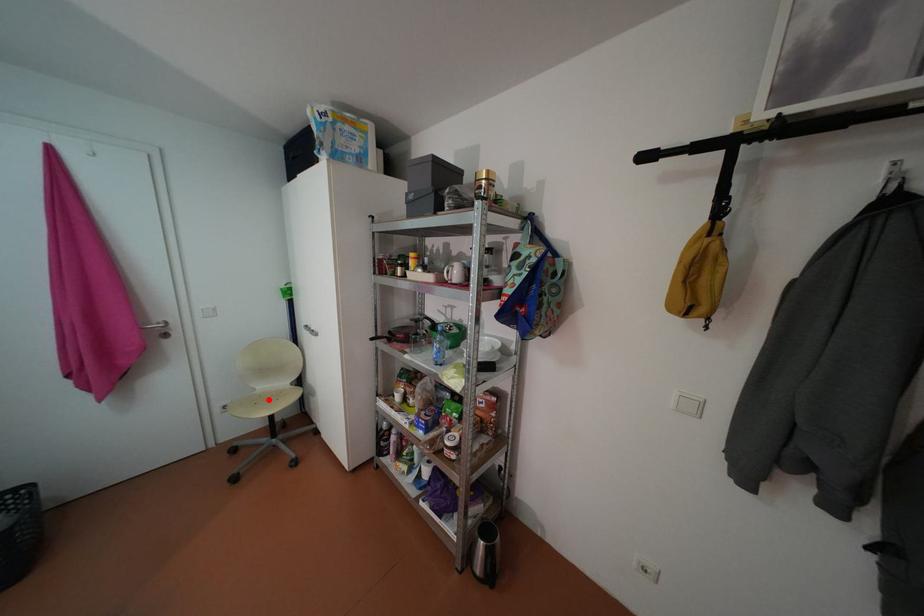
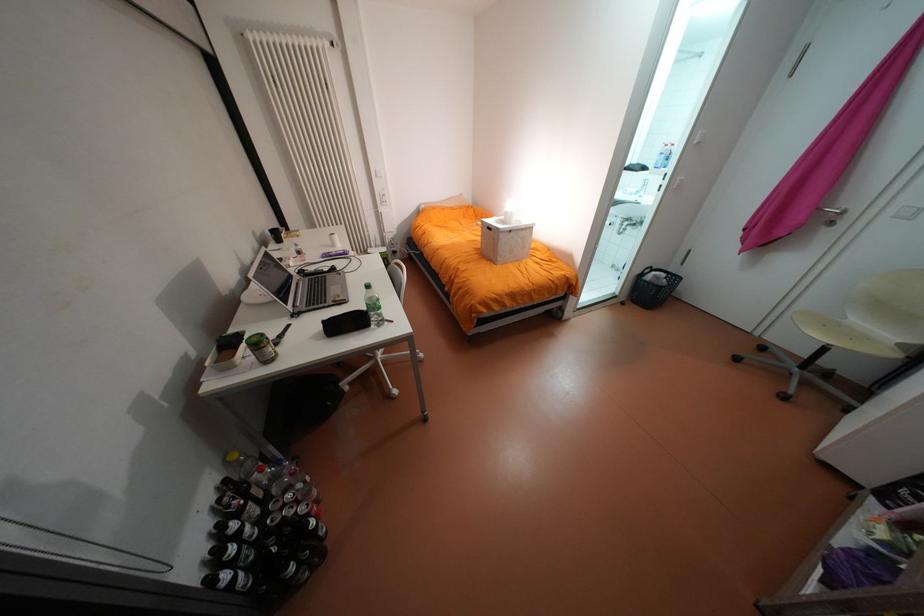
In the second image, find the point that corresponds to the highlighted location in the first image.

(840, 323)